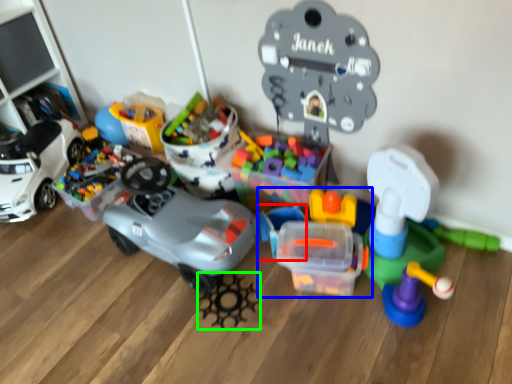
Question: Considering the real-world distances, which object is farthest from toy (highlighted by a red box)? toy (highlighted by a blue box) or toy (highlighted by a green box)?

Choices:
 (A) toy
 (B) toy

Answer: (B)